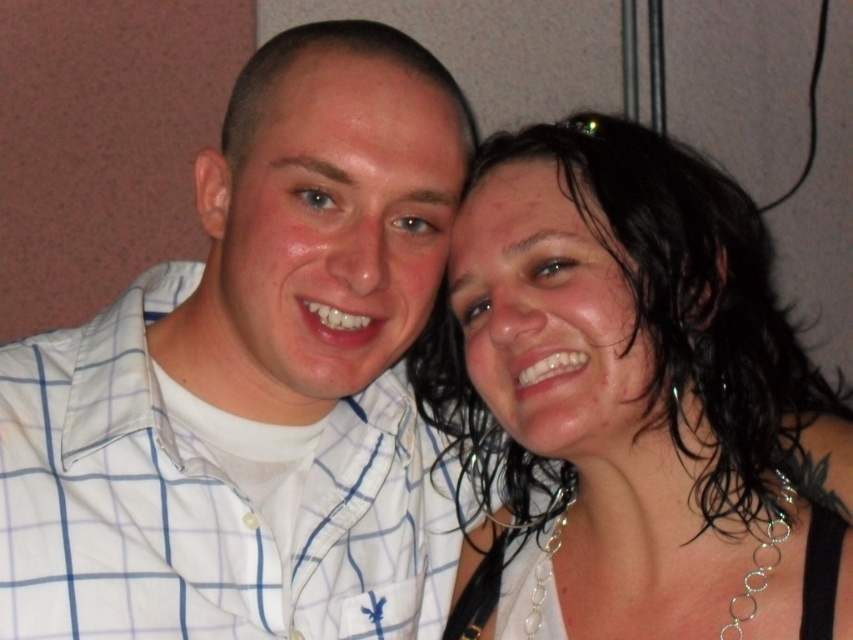
Question: Can you confirm if white checkered shirt at center is thinner than wet hair at center?

Choices:
 (A) no
 (B) yes

Answer: (B)

Question: Considering the relative positions of white checkered shirt at center and smooth skin face at center in the image provided, where is white checkered shirt at center located with respect to smooth skin face at center?

Choices:
 (A) right
 (B) left

Answer: (B)

Question: Is wet hair at center closer to the viewer compared to smooth skin face at center?

Choices:
 (A) yes
 (B) no

Answer: (A)

Question: Estimate the real-world distances between objects in this image. Which object is closer to the matte white shirt at center?

Choices:
 (A) white checkered shirt at center
 (B) smooth skin face at center

Answer: (A)

Question: Which of the following is the closest to the observer?

Choices:
 (A) (592, 234)
 (B) (497, 604)

Answer: (A)

Question: Which point is closer to the camera taking this photo?

Choices:
 (A) (415, 211)
 (B) (403, 310)
 (C) (550, 184)

Answer: (A)